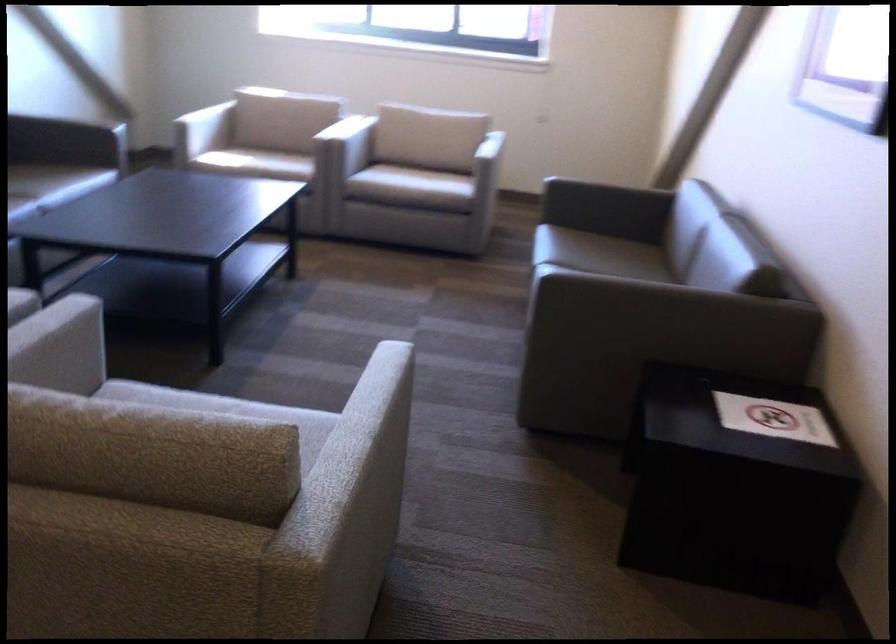
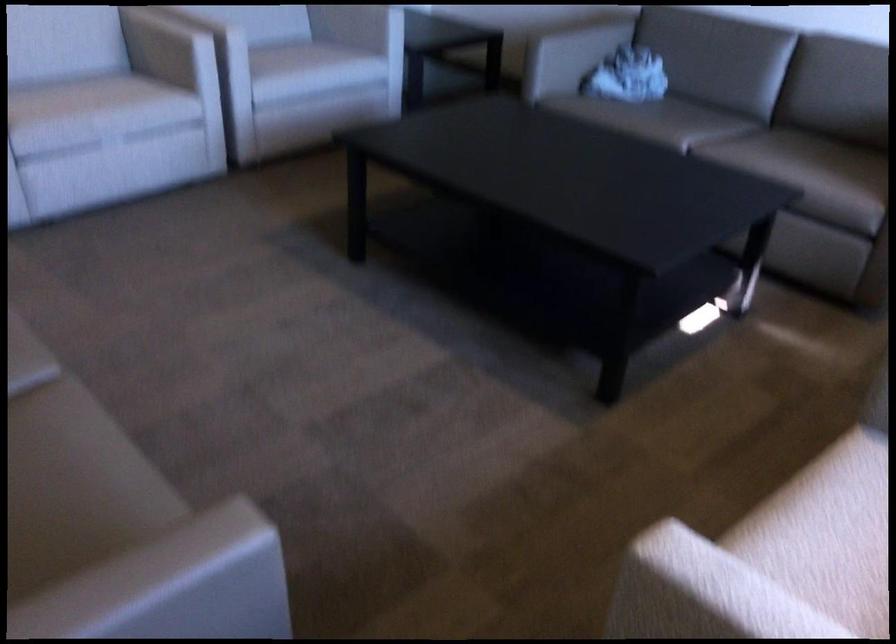
Question: I am providing you with two images of the same scene from different viewpoints. Which of the following objects are not visible in image2?

Choices:
 (A) white chair sitting surface
 (B) chair sitting surface
 (C) maroon sitting surface
 (D) sofa sitting surface

Answer: (B)